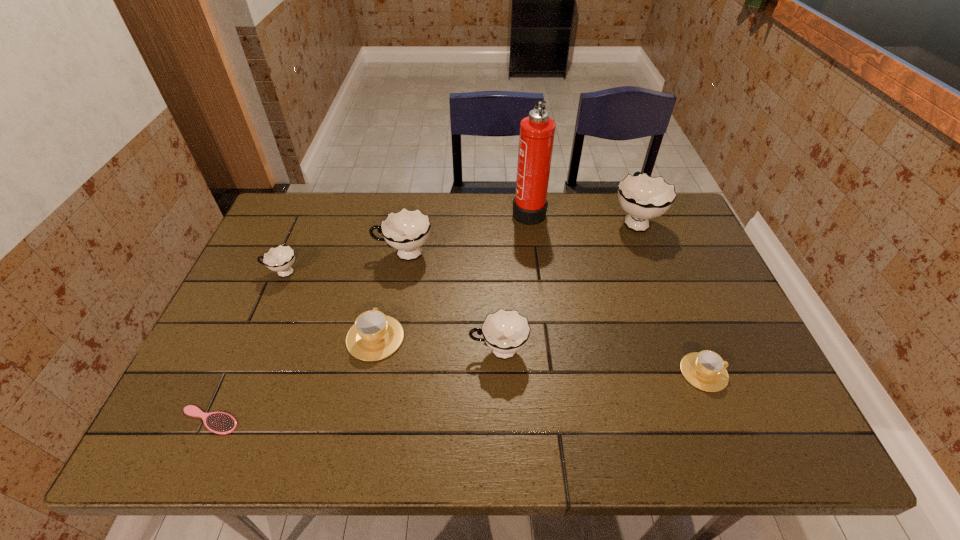
Find the location of a particular element. The image size is (960, 540). the bigger brown cup is located at coordinates (374, 336).

At what (x,y) coordinates should I click in order to perform the action: click on the smaller brown cup. Please return your answer as a coordinate pair (x, y). The height and width of the screenshot is (540, 960). Looking at the image, I should click on click(706, 370).

The width and height of the screenshot is (960, 540). What are the coordinates of `the shortest cup` in the screenshot? It's located at (706, 370).

The image size is (960, 540). I want to click on the nearest object, so click(222, 423).

You are a GUI agent. You are given a task and a screenshot of the screen. Output one action in this format:
    pyautogui.click(x=<x>, y=<y>)
    Task: Click on the hairbrush
    Image resolution: width=960 pixels, height=540 pixels.
    Given the screenshot: What is the action you would take?
    pyautogui.click(x=222, y=423)

Image resolution: width=960 pixels, height=540 pixels. I want to click on free space located on the front-facing side of the tallest object, so click(x=491, y=211).

The image size is (960, 540). In order to click on vacant space located on the front-facing side of the tallest object in this screenshot , I will do `click(493, 211)`.

The width and height of the screenshot is (960, 540). In order to click on vacant position located 0.300m on the front-facing side of the tallest object in this screenshot , I will do `click(421, 211)`.

In order to click on vacant space located on the side of the sixth shortest object with the handle in this screenshot , I will do `click(331, 254)`.

The height and width of the screenshot is (540, 960). Find the location of `vacant position located on the side of the sixth shortest object with the handle`. vacant position located on the side of the sixth shortest object with the handle is located at coordinates (357, 254).